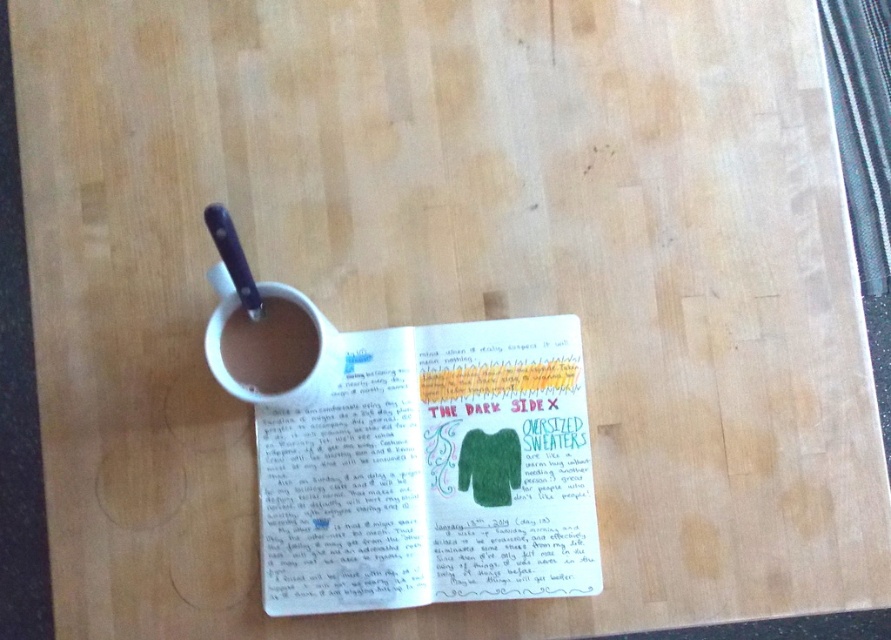
Is white paper at center smaller than matte white mug at upper left?

Incorrect, white paper at center is not smaller in size than matte white mug at upper left.

Between point (473, 541) and point (293, 291), which one is positioned in front?

Positioned in front is point (293, 291).

Which is in front, point (325, 458) or point (227, 380)?

Point (227, 380) is more forward.

Find the location of a particular element. white paper at center is located at coordinates (432, 472).

Who is more forward, [366,456] or [262,371]?

Point [262,371] is more forward.

Can you confirm if white paper at center is positioned below brown matte mug at upper center?

Indeed, white paper at center is positioned under brown matte mug at upper center.

Locate an element on the screen. Image resolution: width=891 pixels, height=640 pixels. white paper at center is located at coordinates (432, 472).

Is brown matte mug at upper center smaller than matte white mug at upper left?

Yes.

Is brown matte mug at upper center shorter than matte white mug at upper left?

Yes, brown matte mug at upper center is shorter than matte white mug at upper left.

Is point (272, 376) more distant than point (218, 308)?

Yes, it is.

At what (x,y) coordinates should I click in order to perform the action: click on brown matte mug at upper center. Please return your answer as a coordinate pair (x, y). Looking at the image, I should click on (268, 346).